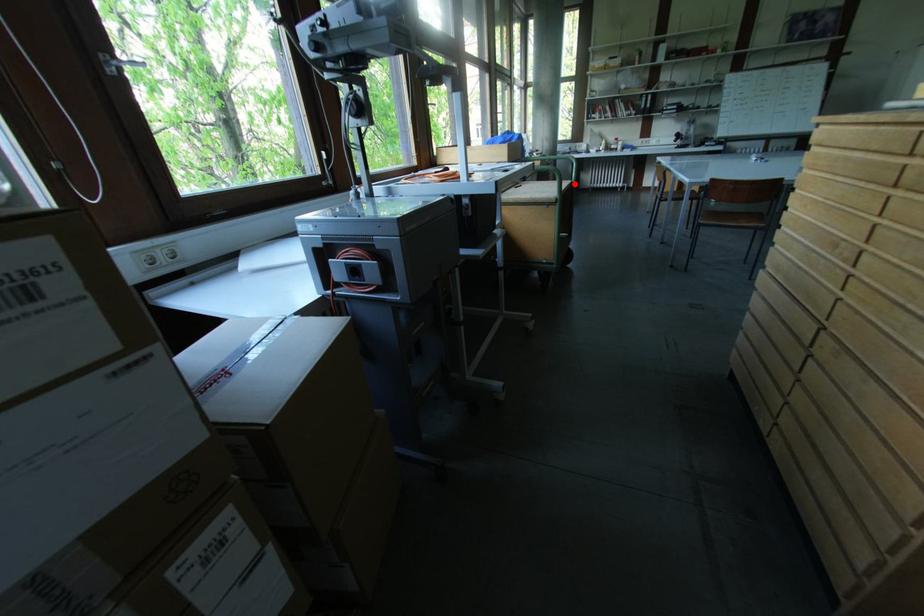
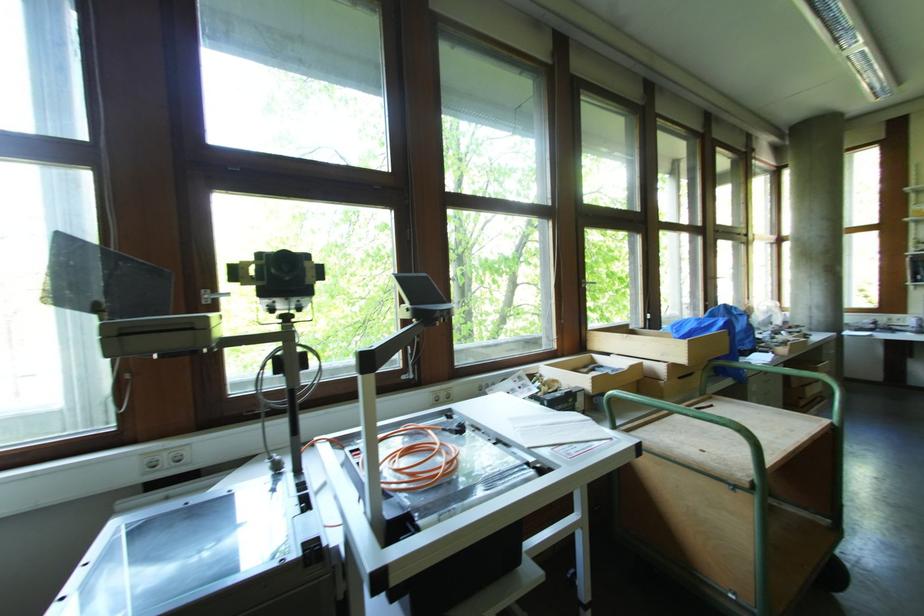
Question: I am providing you with two images of the same scene from different viewpoints. Given a red point in image1, look at the same physical point in image2. Is it:

Choices:
 (A) Closer to the viewpoint
 (B) Farther from the viewpoint

Answer: (A)